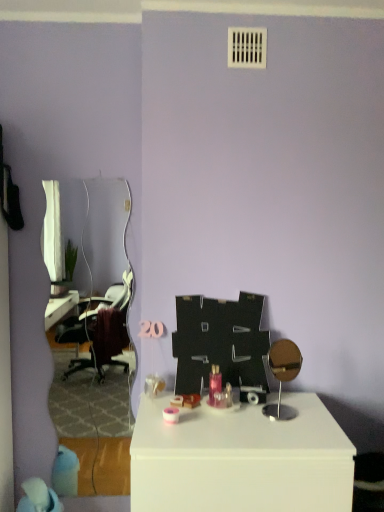
Question: Choose the correct answer: Is white glossy table at center inside white glossy mirror at left or outside it?

Choices:
 (A) outside
 (B) inside

Answer: (A)

Question: Considering the positions of point (309, 501) and point (127, 207), is point (309, 501) closer or farther from the camera than point (127, 207)?

Choices:
 (A) farther
 (B) closer

Answer: (B)

Question: Which object is the farthest from the blue fabric bean bag chair at lower left?

Choices:
 (A) white glossy table at center
 (B) white glossy mirror at left

Answer: (B)

Question: Based on their relative distances, which object is nearer to the white glossy table at center?

Choices:
 (A) white glossy mirror at left
 (B) blue fabric bean bag chair at lower left

Answer: (B)